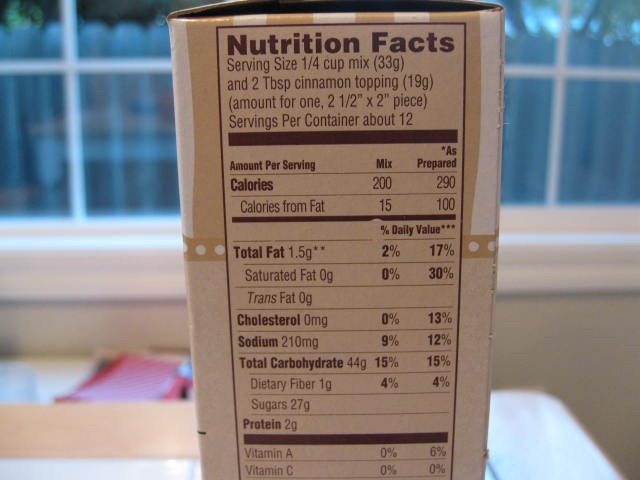
In order to click on table in this screenshot , I will do `click(56, 374)`.